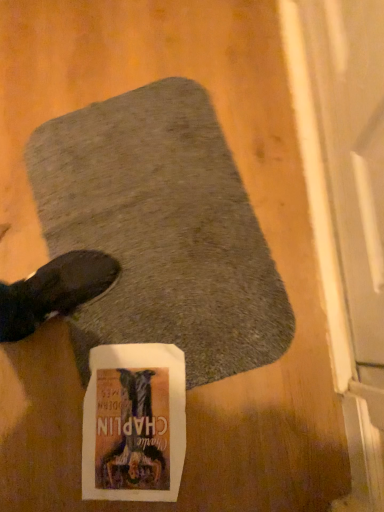
Identify the location of vacant area that is situated to the right of gray soft rug at center. (266, 146).